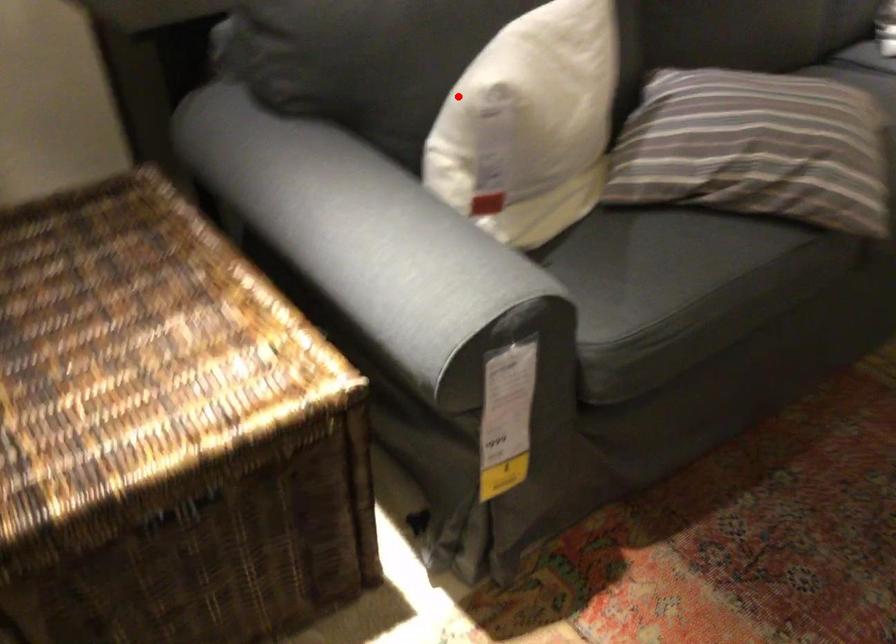
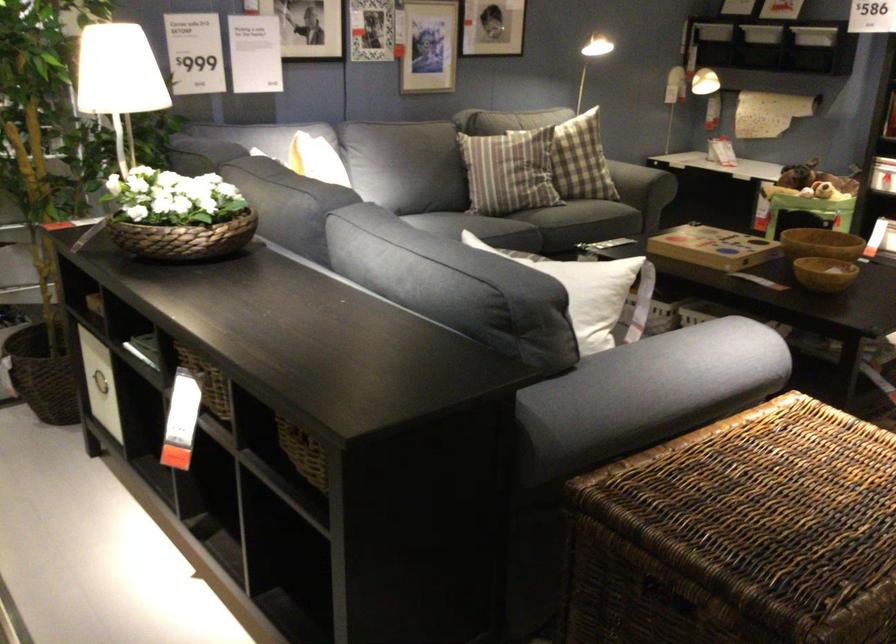
Question: I am providing you with two images of the same scene from different viewpoints. A red point is shown in image1. For the corresponding object point in image2, is it positioned nearer or farther from the camera?

Choices:
 (A) Nearer
 (B) Farther

Answer: (B)